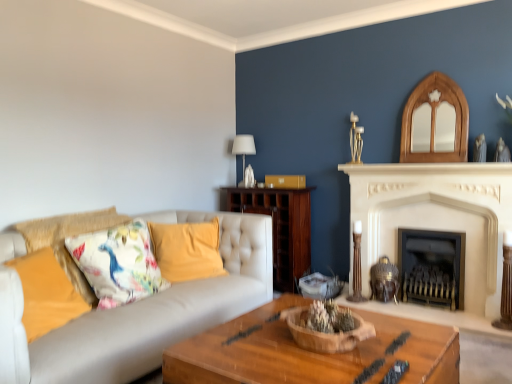
What do you see at coordinates (309, 352) in the screenshot? I see `wooden coffee table at center` at bounding box center [309, 352].

Locate an element on the screen. The height and width of the screenshot is (384, 512). white stone fireplace at center, the first fireplace positioned from the left is located at coordinates (437, 222).

What do you see at coordinates (281, 227) in the screenshot? The height and width of the screenshot is (384, 512). I see `dark brown wood cabinet at center` at bounding box center [281, 227].

Describe the element at coordinates (46, 293) in the screenshot. Image resolution: width=512 pixels, height=384 pixels. I see `floral fabric cushion at left, the second pillow from the back` at that location.

Image resolution: width=512 pixels, height=384 pixels. Describe the element at coordinates (426, 169) in the screenshot. I see `white marble fireplace at upper center` at that location.

This screenshot has width=512, height=384. What are the coordinates of `yellow fabric pillow at center, which is the second pillow from left to right` in the screenshot? It's located at (187, 250).

You are a GUI agent. You are given a task and a screenshot of the screen. Output one action in this format:
    pyautogui.click(x=<x>, y=<y>)
    Task: Click on the pillow lying on the right of floral fabric cushion at left, the 2th pillow viewed from the right
    The width and height of the screenshot is (512, 384).
    Given the screenshot: What is the action you would take?
    pyautogui.click(x=187, y=250)

Based on the photo, considering the sizes of yellow fabric pillow at center, which is the first pillow in back-to-front order, and floral fabric cushion at left, the second pillow from the back, in the image, is yellow fabric pillow at center, which is the first pillow in back-to-front order, bigger or smaller than floral fabric cushion at left, the second pillow from the back,?

Considering their sizes, yellow fabric pillow at center, which is the first pillow in back-to-front order, takes up more space than floral fabric cushion at left, the second pillow from the back.

How different are the orientations of yellow fabric pillow at center, which ranks as the 1th pillow in right-to-left order, and floral fabric cushion at left, the second pillow from the back, in degrees?

53.9 degrees separate the facing orientations of yellow fabric pillow at center, which ranks as the 1th pillow in right-to-left order, and floral fabric cushion at left, the second pillow from the back.

Is white marble fireplace at upper center in front of or behind yellow fabric pillow at center, acting as the second pillow starting from the front, in the image?

Visually, white marble fireplace at upper center is located in front of yellow fabric pillow at center, acting as the second pillow starting from the front.

From a real-world perspective, is white marble fireplace at upper center under yellow fabric pillow at center, which ranks as the 1th pillow in right-to-left order?

No, from a real-world perspective, white marble fireplace at upper center is not below yellow fabric pillow at center, which ranks as the 1th pillow in right-to-left order.

Can you tell me how much white marble fireplace at upper center and yellow fabric pillow at center, which ranks as the 1th pillow in right-to-left order, differ in facing direction?

The facing directions of white marble fireplace at upper center and yellow fabric pillow at center, which ranks as the 1th pillow in right-to-left order, are 49.6 degrees apart.

In the scene shown: Is white marble fireplace at upper center beside yellow fabric pillow at center, acting as the second pillow starting from the front?

No, white marble fireplace at upper center is not next to yellow fabric pillow at center, acting as the second pillow starting from the front.

Is black metal fireplace at center, arranged as the 1th fireplace when viewed from the right, in front of or behind white stone fireplace at center, the 2th fireplace positioned from the right, in the image?

black metal fireplace at center, arranged as the 1th fireplace when viewed from the right, is positioned farther from the viewer than white stone fireplace at center, the 2th fireplace positioned from the right.

From a real-world perspective, is black metal fireplace at center, arranged as the 1th fireplace when viewed from the right, on top of white stone fireplace at center, the 2th fireplace positioned from the right?

No, from a real-world perspective, black metal fireplace at center, arranged as the 1th fireplace when viewed from the right, is not above white stone fireplace at center, the 2th fireplace positioned from the right.

Which of these two, black metal fireplace at center, arranged as the 1th fireplace when viewed from the right, or white stone fireplace at center, the 2th fireplace positioned from the right, is smaller?

black metal fireplace at center, arranged as the 1th fireplace when viewed from the right.

Looking at this image, considering the sizes of black metal fireplace at center, arranged as the 1th fireplace when viewed from the right, and white stone fireplace at center, the 2th fireplace positioned from the right, in the image, is black metal fireplace at center, arranged as the 1th fireplace when viewed from the right, taller or shorter than white stone fireplace at center, the 2th fireplace positioned from the right,?

Clearly, black metal fireplace at center, arranged as the 1th fireplace when viewed from the right, is shorter compared to white stone fireplace at center, the 2th fireplace positioned from the right.

From the picture: From the image's perspective, is black metal fireplace at center, which appears as the 2th fireplace when viewed from the left, above or below wooden bowl at center?

Clearly, from the image's perspective, black metal fireplace at center, which appears as the 2th fireplace when viewed from the left, is below wooden bowl at center.

How many degrees apart are the facing directions of black metal fireplace at center, which appears as the 2th fireplace when viewed from the left, and wooden bowl at center?

There is a 2.48-degree angle between the facing directions of black metal fireplace at center, which appears as the 2th fireplace when viewed from the left, and wooden bowl at center.

Between black metal fireplace at center, arranged as the 1th fireplace when viewed from the right, and wooden bowl at center, which one has less height?

With less height is wooden bowl at center.

Would you say black metal fireplace at center, arranged as the 1th fireplace when viewed from the right, contains wooden bowl at center?

No, wooden bowl at center is located outside of black metal fireplace at center, arranged as the 1th fireplace when viewed from the right.

Is black metal fireplace at center, which appears as the 2th fireplace when viewed from the left, bigger or smaller than wooden coffee table at center?

black metal fireplace at center, which appears as the 2th fireplace when viewed from the left, is smaller than wooden coffee table at center.

From the image's perspective, relative to wooden coffee table at center, is black metal fireplace at center, which appears as the 2th fireplace when viewed from the left, above or below?

black metal fireplace at center, which appears as the 2th fireplace when viewed from the left, is above wooden coffee table at center.

Considering the sizes of black metal fireplace at center, arranged as the 1th fireplace when viewed from the right, and wooden coffee table at center in the image, is black metal fireplace at center, arranged as the 1th fireplace when viewed from the right, taller or shorter than wooden coffee table at center?

Considering their sizes, black metal fireplace at center, arranged as the 1th fireplace when viewed from the right, has more height than wooden coffee table at center.

Could you tell me if black metal fireplace at center, arranged as the 1th fireplace when viewed from the right, is facing wooden coffee table at center?

Yes, black metal fireplace at center, arranged as the 1th fireplace when viewed from the right, is aimed at wooden coffee table at center.

From the image's perspective, is wooden coffee table at center under white stone fireplace at center, the 2th fireplace positioned from the right?

Yes, from the image's perspective, wooden coffee table at center is below white stone fireplace at center, the 2th fireplace positioned from the right.

Which is correct: wooden coffee table at center is inside white stone fireplace at center, the 2th fireplace positioned from the right, or outside of it?

wooden coffee table at center is located beyond the bounds of white stone fireplace at center, the 2th fireplace positioned from the right.

Between wooden coffee table at center and white stone fireplace at center, the 2th fireplace positioned from the right, which one appears on the right side from the viewer's perspective?

white stone fireplace at center, the 2th fireplace positioned from the right.

Image resolution: width=512 pixels, height=384 pixels. I want to click on table that appears below the white stone fireplace at center, the 2th fireplace positioned from the right (from a real-world perspective), so click(x=309, y=352).

Considering the sizes of objects white fabric lampshade at upper center and dark brown wood cabinet at center in the image provided, who is shorter, white fabric lampshade at upper center or dark brown wood cabinet at center?

With less height is white fabric lampshade at upper center.

In the image, is white fabric lampshade at upper center positioned in front of or behind dark brown wood cabinet at center?

white fabric lampshade at upper center is behind dark brown wood cabinet at center.

Is white fabric lampshade at upper center bigger than dark brown wood cabinet at center?

Incorrect, white fabric lampshade at upper center is not larger than dark brown wood cabinet at center.

Does white fabric lampshade at upper center touch dark brown wood cabinet at center?

No.

At what (x,y) coordinates should I click in order to perform the action: click on pillow above the floral fabric cushion at left, acting as the first pillow starting from the front (from the image's perspective). Please return your answer as a coordinate pair (x, y). The image size is (512, 384). Looking at the image, I should click on (187, 250).

Identify the location of the 1st pillow to the left of the white marble fireplace at upper center, counting from the anchor's position. This screenshot has width=512, height=384. (187, 250).

From the picture: From the image, which object appears to be nearer to floral fabric cushion at left, the second pillow from the back, white fabric lampshade at upper center or white stone fireplace at center, the 2th fireplace positioned from the right?

Based on the image, white fabric lampshade at upper center appears to be nearer to floral fabric cushion at left, the second pillow from the back.

Which object lies further to the anchor point black metal fireplace at center, which appears as the 2th fireplace when viewed from the left, white fabric lampshade at upper center or floral fabric cushion at left, acting as the first pillow starting from the front?

floral fabric cushion at left, acting as the first pillow starting from the front, is positioned further to the anchor black metal fireplace at center, which appears as the 2th fireplace when viewed from the left.

Considering their positions, is floral fabric cushion at left, the second pillow from the back, positioned further to black metal fireplace at center, arranged as the 1th fireplace when viewed from the right, than dark brown wood cabinet at center?

floral fabric cushion at left, the second pillow from the back, is further to black metal fireplace at center, arranged as the 1th fireplace when viewed from the right.

Based on the photo, when comparing their distances from wooden coffee table at center, does wooden bowl at center or black metal fireplace at center, which appears as the 2th fireplace when viewed from the left, seem further?

black metal fireplace at center, which appears as the 2th fireplace when viewed from the left.

Looking at the image, which one is located further to white stone fireplace at center, the 2th fireplace positioned from the right, white fabric lampshade at upper center or wooden coffee table at center?

Based on the image, white fabric lampshade at upper center appears to be further to white stone fireplace at center, the 2th fireplace positioned from the right.

Looking at this image, which object lies further to the anchor point wooden coffee table at center, black metal fireplace at center, which appears as the 2th fireplace when viewed from the left, or white stone fireplace at center, the first fireplace positioned from the left?

The object further to wooden coffee table at center is black metal fireplace at center, which appears as the 2th fireplace when viewed from the left.

Based on their spatial positions, is white marble fireplace at upper center or floral fabric cushion at left, acting as the first pillow starting from the front, closer to floral fabric cushion at left?

floral fabric cushion at left, acting as the first pillow starting from the front.

Looking at the image, which one is located further to wooden bowl at center, wooden coffee table at center or white stone fireplace at center, the 2th fireplace positioned from the right?

white stone fireplace at center, the 2th fireplace positioned from the right, lies further to wooden bowl at center than the other object.

Where is `throw pillow between floral fabric cushion at left, the second pillow from the back, and yellow fabric pillow at center, which is the second pillow from left to right, in the front-back direction`? The width and height of the screenshot is (512, 384). throw pillow between floral fabric cushion at left, the second pillow from the back, and yellow fabric pillow at center, which is the second pillow from left to right, in the front-back direction is located at coordinates (118, 263).

The image size is (512, 384). I want to click on hardwood between floral fabric cushion at left, the 1th pillow positioned from the left, and white fabric lampshade at upper center in the front-back direction, so pyautogui.click(x=281, y=227).

Where is `mantle between floral fabric cushion at left, the 1th pillow positioned from the left, and white stone fireplace at center, the 2th fireplace positioned from the right, from left to right`? This screenshot has height=384, width=512. mantle between floral fabric cushion at left, the 1th pillow positioned from the left, and white stone fireplace at center, the 2th fireplace positioned from the right, from left to right is located at coordinates (426, 169).

This screenshot has height=384, width=512. I want to click on throw pillow between floral fabric cushion at left, the second pillow from the back, and white fabric lampshade at upper center from front to back, so click(x=118, y=263).